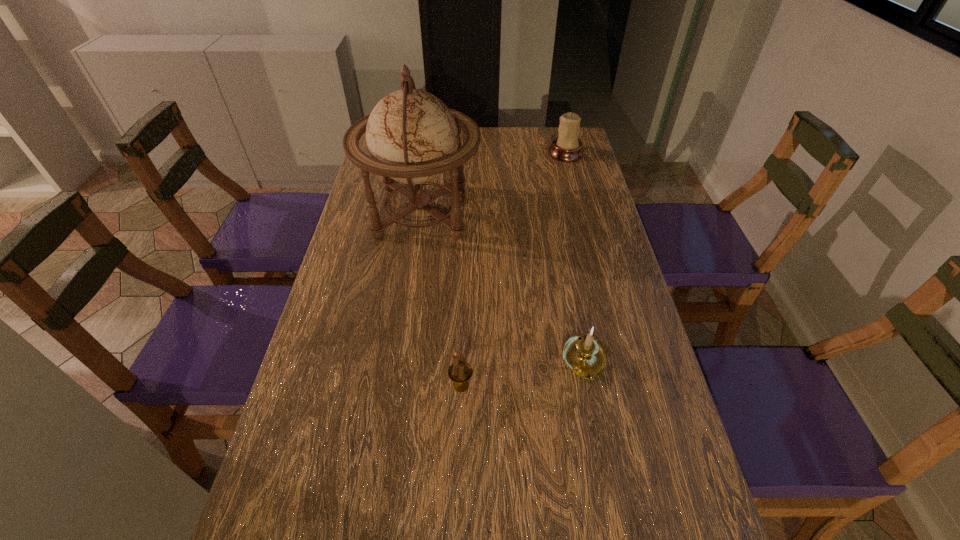
The height and width of the screenshot is (540, 960). I want to click on object that is the second closest to the tallest object, so click(583, 354).

This screenshot has width=960, height=540. Identify the location of the third closest object to the farthest candle holder. (460, 372).

Choose which candle holder is the second nearest neighbor to the leftmost candle holder. Please provide its 2D coordinates. Your answer should be formatted as a tuple, i.e. [(x, y)], where the tuple contains the x and y coordinates of a point satisfying the conditions above.

[(567, 147)]

Choose which candle holder is the second nearest neighbor to the globe. Please provide its 2D coordinates. Your answer should be formatted as a tuple, i.e. [(x, y)], where the tuple contains the x and y coordinates of a point satisfying the conditions above.

[(583, 354)]

Where is `free location that satisfies the following two spatial constraints: 1. on the back side of the leftmost candle holder; 2. at the front of the second farthest object showing Africa`? This screenshot has height=540, width=960. free location that satisfies the following two spatial constraints: 1. on the back side of the leftmost candle holder; 2. at the front of the second farthest object showing Africa is located at coordinates (467, 212).

Locate an element on the screen. vacant region that satisfies the following two spatial constraints: 1. on the back side of the farthest candle holder; 2. on the right side of the leftmost candle holder is located at coordinates (468, 153).

The image size is (960, 540). In order to click on vacant area in the image that satisfies the following two spatial constraints: 1. on the back side of the leftmost candle holder; 2. at the front of the tallest object showing Africa in this screenshot , I will do `click(467, 212)`.

Locate an element on the screen. The image size is (960, 540). blank area in the image that satisfies the following two spatial constraints: 1. at the front of the leftmost candle holder showing Africa; 2. on the right side of the second farthest object is located at coordinates (396, 386).